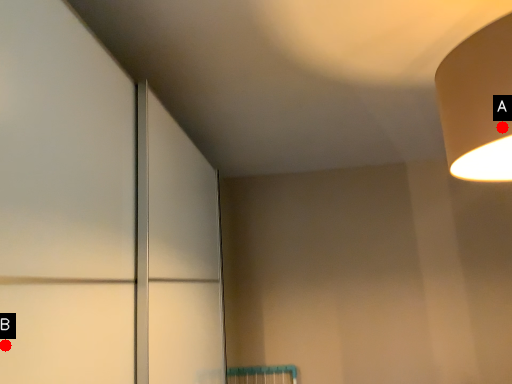
Question: Two points are circled on the image, labeled by A and B beside each circle. Among these points, which one is farthest from the camera?

Choices:
 (A) A is further
 (B) B is further

Answer: (A)